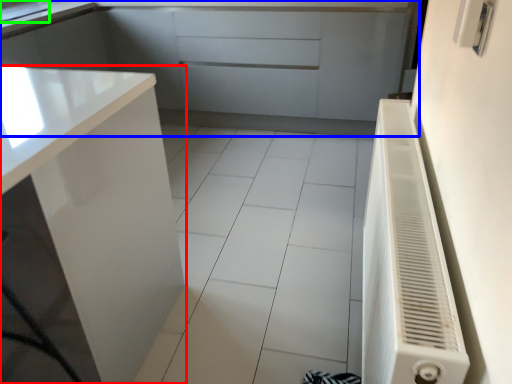
Question: Which object is positioned closest to cabinetry (highlighted by a red box)? Select from cabinetry (highlighted by a blue box) and sink (highlighted by a green box).

Choices:
 (A) cabinetry
 (B) sink

Answer: (A)